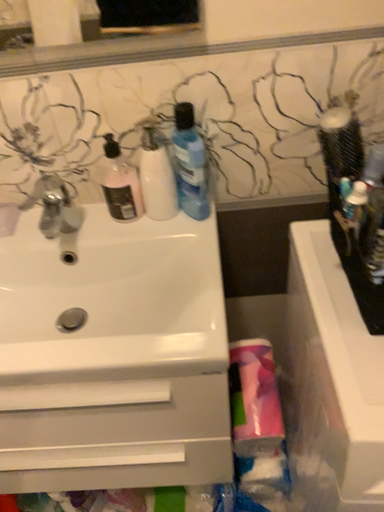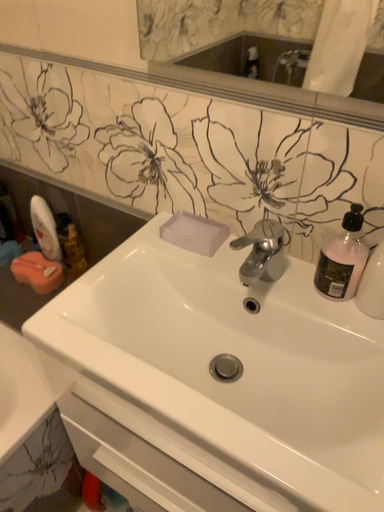
Question: Which way did the camera rotate in the video?

Choices:
 (A) rotated upward
 (B) rotated downward

Answer: (A)